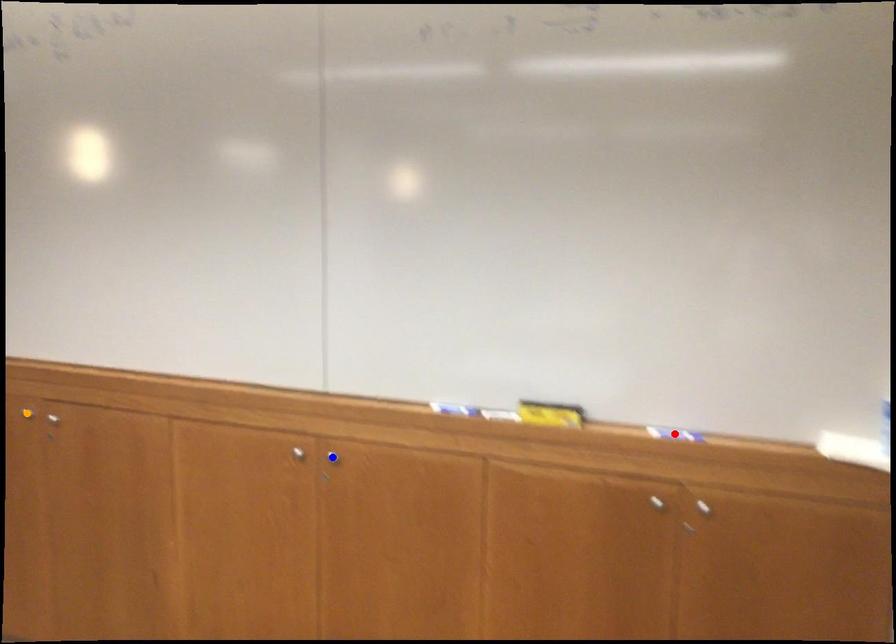
Order these from farthest to nearest:
A) red point
B) orange point
C) blue point

orange point
blue point
red point